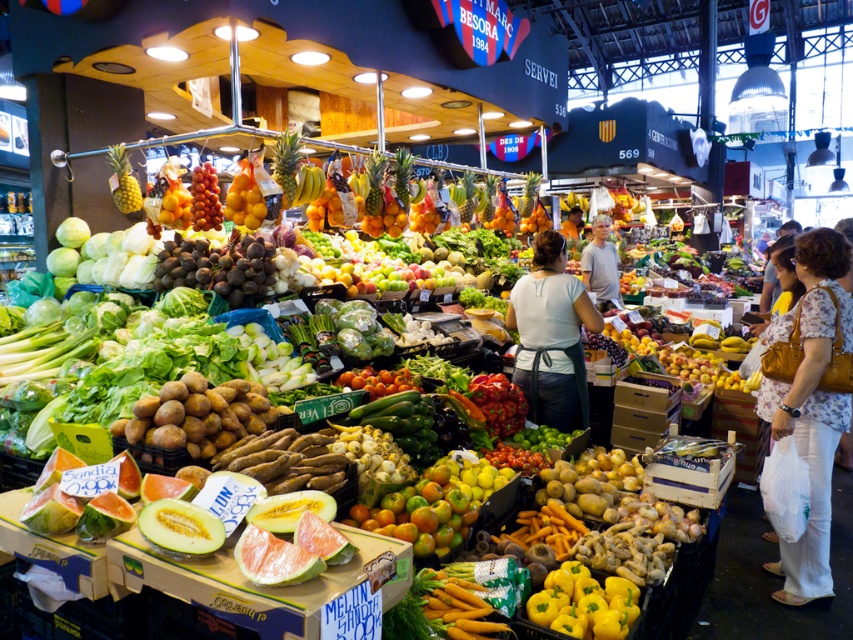
Question: In this image, where is white fabric apron at center located relative to yellow matte bell pepper at center?

Choices:
 (A) below
 (B) above

Answer: (B)

Question: Observing the image, what is the correct spatial positioning of smooth white shirt at center in reference to yellow glossy grapes at center?

Choices:
 (A) below
 (B) above

Answer: (A)

Question: In this image, where is floral print blouse at center located relative to yellow glossy grapes at center?

Choices:
 (A) above
 (B) below

Answer: (B)

Question: Based on their relative distances, which object is farther from the yellow glossy grapes at center?

Choices:
 (A) golden textured pineapple at upper left
 (B) smooth white shirt at center
 (C) yellow matte bell pepper at center

Answer: (B)

Question: Which is nearer to the floral print blouse at center?

Choices:
 (A) yellow matte bell pepper at center
 (B) golden textured pineapple at upper left
 (C) white fabric apron at center
 (D) smooth white shirt at center

Answer: (C)

Question: Which point is closer to the camera?

Choices:
 (A) (x=630, y=580)
 (B) (x=606, y=232)

Answer: (A)